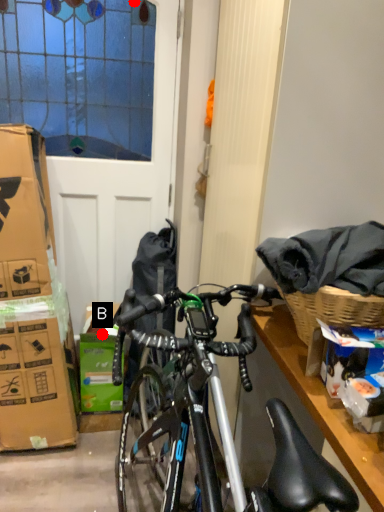
Question: Two points are circled on the image, labeled by A and B beside each circle. Which of the following is the farthest from the observer?

Choices:
 (A) A is further
 (B) B is further

Answer: (B)